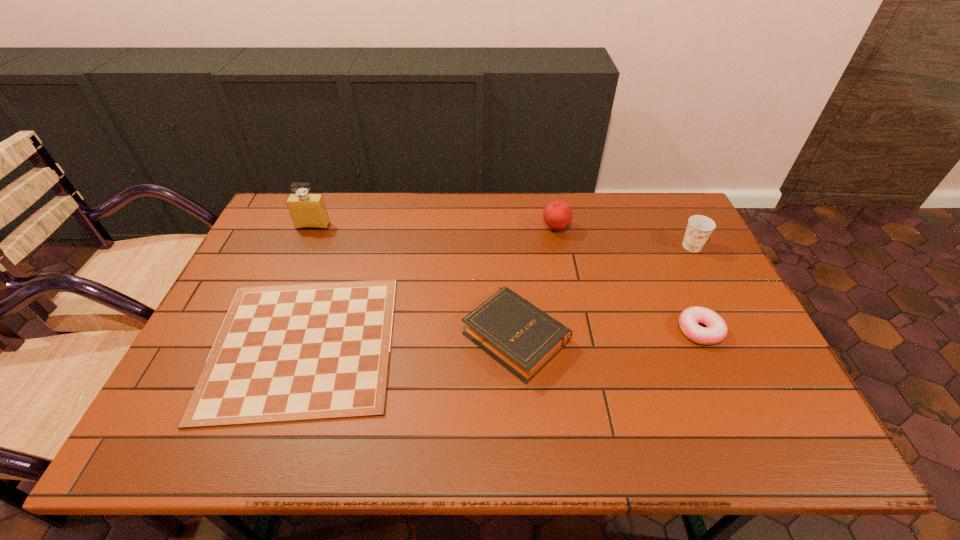
Image resolution: width=960 pixels, height=540 pixels. Find the location of `vacant space situated 0.180m on the back of the second shortest object`. vacant space situated 0.180m on the back of the second shortest object is located at coordinates (672, 268).

Locate an element on the screen. The image size is (960, 540). free space located 0.050m on the right of the shortest object is located at coordinates [x=416, y=345].

Identify the location of perfume at the far edge. Image resolution: width=960 pixels, height=540 pixels. (307, 210).

At what (x,y) coordinates should I click in order to perform the action: click on apple located in the far edge section of the desktop. Please return your answer as a coordinate pair (x, y). The image size is (960, 540). Looking at the image, I should click on (557, 214).

Image resolution: width=960 pixels, height=540 pixels. In order to click on object located in the near edge section of the desktop in this screenshot , I will do pyautogui.click(x=299, y=352).

Locate an element on the screen. Image resolution: width=960 pixels, height=540 pixels. perfume that is at the left edge is located at coordinates (307, 210).

You are a GUI agent. You are given a task and a screenshot of the screen. Output one action in this format:
    pyautogui.click(x=<x>, y=<y>)
    Task: Click on the checkerboard situated at the left edge
    
    Given the screenshot: What is the action you would take?
    pyautogui.click(x=299, y=352)

The image size is (960, 540). I want to click on Dixie cup that is at the right edge, so click(699, 228).

What are the coordinates of `doughnut present at the right edge` in the screenshot? It's located at (716, 331).

You are a GUI agent. You are given a task and a screenshot of the screen. Output one action in this format:
    pyautogui.click(x=<x>, y=<y>)
    Task: Click on the object at the far left corner
    This screenshot has height=540, width=960.
    Given the screenshot: What is the action you would take?
    pyautogui.click(x=307, y=210)